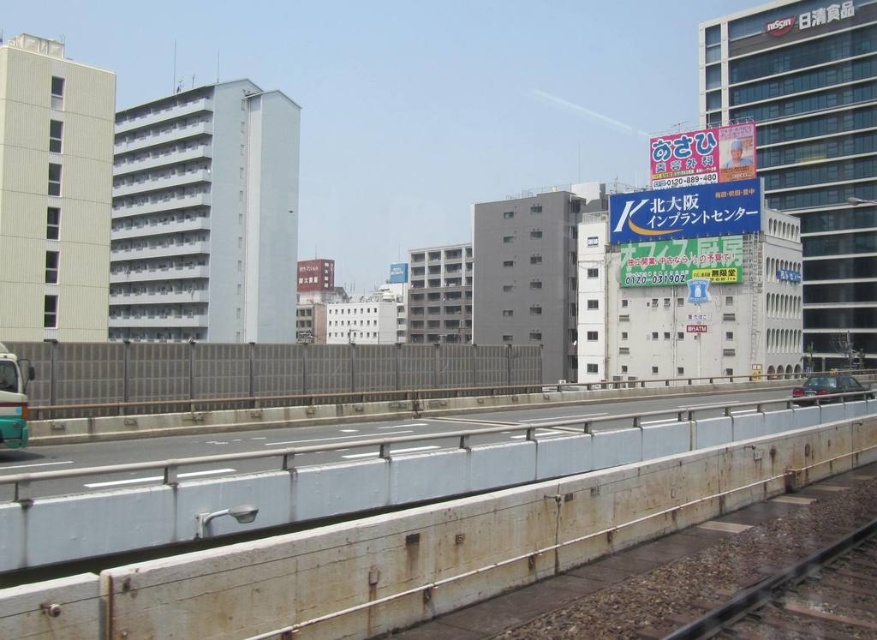
Which of these two, brown wooden train track at lower right or teal matte bus at left, stands shorter?

brown wooden train track at lower right is shorter.

Between point (754, 584) and point (0, 365), which one is positioned behind?

The point (0, 365) is more distant.

What do you see at coordinates (768, 588) in the screenshot? I see `brown wooden train track at lower right` at bounding box center [768, 588].

Where is `brown wooden train track at lower right`? The image size is (877, 640). brown wooden train track at lower right is located at coordinates (768, 588).

Is point (27, 436) farther from viewer compared to point (853, 388)?

No.

Is teal matte bus at left to the left of metallic silver car at right from the viewer's perspective?

Indeed, teal matte bus at left is positioned on the left side of metallic silver car at right.

Which is behind, point (18, 428) or point (825, 390)?

The point (825, 390) is more distant.

The image size is (877, 640). Identify the location of teal matte bus at left. (12, 400).

Consider the image. Is brown wooden train track at lower right to the left of metallic silver car at right from the viewer's perspective?

Indeed, brown wooden train track at lower right is positioned on the left side of metallic silver car at right.

Which is more to the right, brown wooden train track at lower right or metallic silver car at right?

From the viewer's perspective, metallic silver car at right appears more on the right side.

The height and width of the screenshot is (640, 877). In order to click on brown wooden train track at lower right in this screenshot , I will do `click(768, 588)`.

Where is `brown wooden train track at lower right`? The image size is (877, 640). brown wooden train track at lower right is located at coordinates (768, 588).